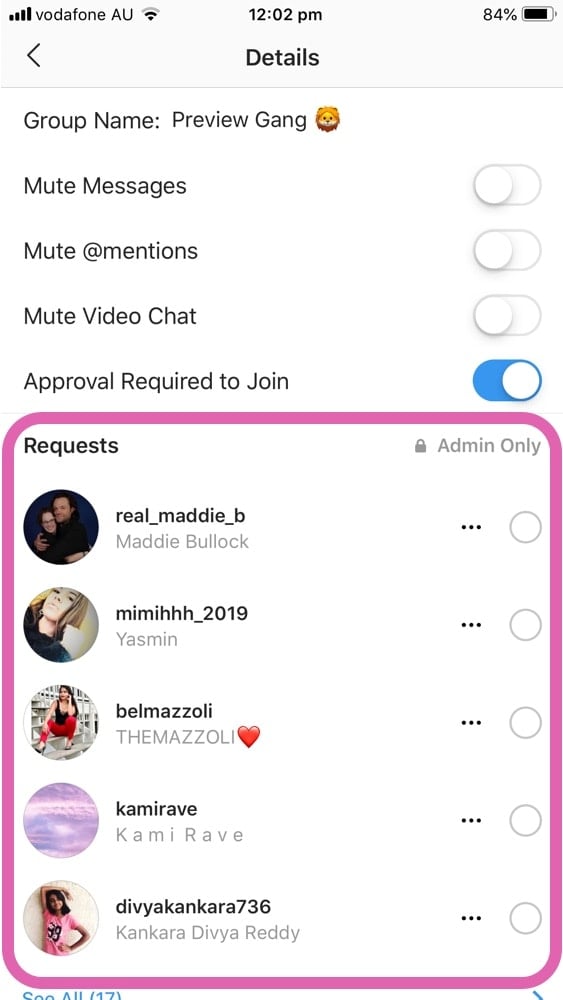
Find the location of `on switch button`. on switch button is located at coordinates (503, 379).